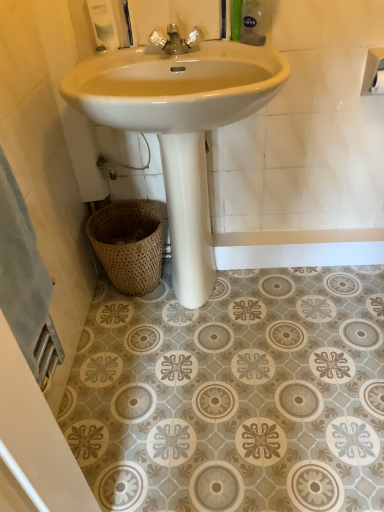
Question: Can we say white matte toilet paper at upper right, which ranks as the first toilet paper in front-to-back order, lies outside white matte toilet paper at upper right, which ranks as the first toilet paper in back-to-front order?

Choices:
 (A) yes
 (B) no

Answer: (A)

Question: Is white matte toilet paper at upper right, which ranks as the first toilet paper in front-to-back order, looking in the opposite direction of white matte toilet paper at upper right, the 2th toilet paper viewed from the front?

Choices:
 (A) no
 (B) yes

Answer: (B)

Question: From the image's perspective, is white matte toilet paper at upper right, the second toilet paper in the back-to-front sequence, on top of white matte toilet paper at upper right, the 2th toilet paper viewed from the front?

Choices:
 (A) yes
 (B) no

Answer: (A)

Question: Is white matte toilet paper at upper right, the second toilet paper in the back-to-front sequence, not close to white matte toilet paper at upper right, the 2th toilet paper viewed from the front?

Choices:
 (A) yes
 (B) no

Answer: (B)

Question: Can you confirm if white matte toilet paper at upper right, which ranks as the first toilet paper in front-to-back order, is taller than white matte toilet paper at upper right, which ranks as the first toilet paper in back-to-front order?

Choices:
 (A) no
 (B) yes

Answer: (B)

Question: From a real-world perspective, is white matte toilet paper at upper right, which ranks as the first toilet paper in front-to-back order, on white matte toilet paper at upper right, which ranks as the first toilet paper in back-to-front order?

Choices:
 (A) yes
 (B) no

Answer: (A)

Question: Considering the relative sizes of white glossy sink at center and chrome metallic faucet at center in the image provided, is white glossy sink at center bigger than chrome metallic faucet at center?

Choices:
 (A) no
 (B) yes

Answer: (B)

Question: From a real-world perspective, is white glossy sink at center over chrome metallic faucet at center?

Choices:
 (A) yes
 (B) no

Answer: (B)

Question: Does white glossy sink at center appear on the left side of chrome metallic faucet at center?

Choices:
 (A) no
 (B) yes

Answer: (A)

Question: Is white glossy sink at center touching chrome metallic faucet at center?

Choices:
 (A) no
 (B) yes

Answer: (A)

Question: Is white glossy sink at center far from chrome metallic faucet at center?

Choices:
 (A) no
 (B) yes

Answer: (A)

Question: Does white glossy sink at center have a lesser height compared to chrome metallic faucet at center?

Choices:
 (A) no
 (B) yes

Answer: (A)

Question: Considering the relative sizes of white glossy soap dispenser at upper left, the second toiletry viewed from the right, and woven natural basket at lower left in the image provided, is white glossy soap dispenser at upper left, the second toiletry viewed from the right, bigger than woven natural basket at lower left?

Choices:
 (A) yes
 (B) no

Answer: (B)